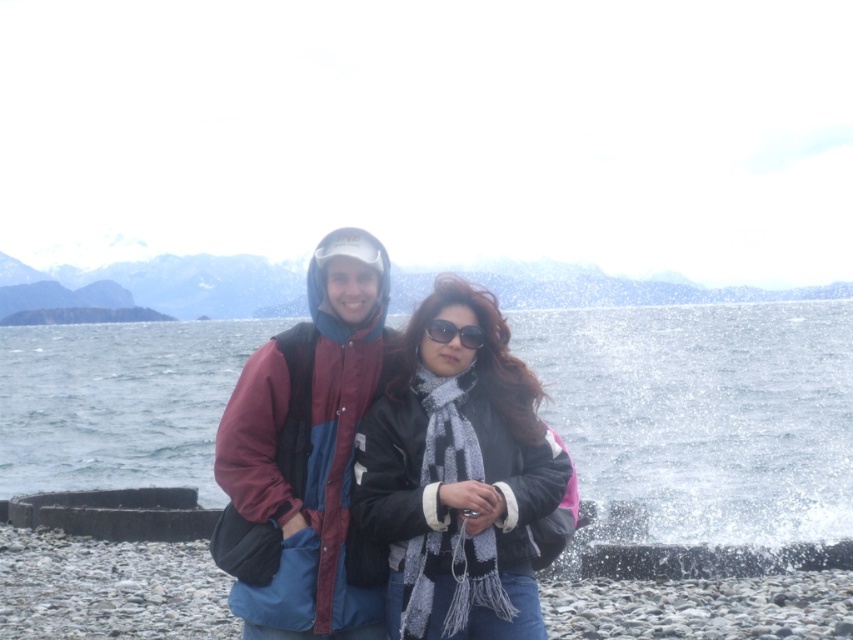
Question: Does clear water at center have a greater width compared to maroon and blue jacket at center?

Choices:
 (A) no
 (B) yes

Answer: (B)

Question: Is maroon and blue jacket at center smaller than black plastic sunglasses at center?

Choices:
 (A) yes
 (B) no

Answer: (B)

Question: Which object appears farthest from the camera in this image?

Choices:
 (A) clear water at center
 (B) black plastic sunglasses at center
 (C) black matte jacket at center

Answer: (A)

Question: Which object appears closest to the camera in this image?

Choices:
 (A) black matte jacket at center
 (B) clear water at center
 (C) black plastic sunglasses at center

Answer: (A)

Question: Which point is farther to the camera?

Choices:
 (A) black plastic sunglasses at center
 (B) maroon and blue jacket at center
 (C) black matte jacket at center
 (D) clear water at center

Answer: (D)

Question: Does black matte jacket at center lie behind black plastic sunglasses at center?

Choices:
 (A) yes
 (B) no

Answer: (B)